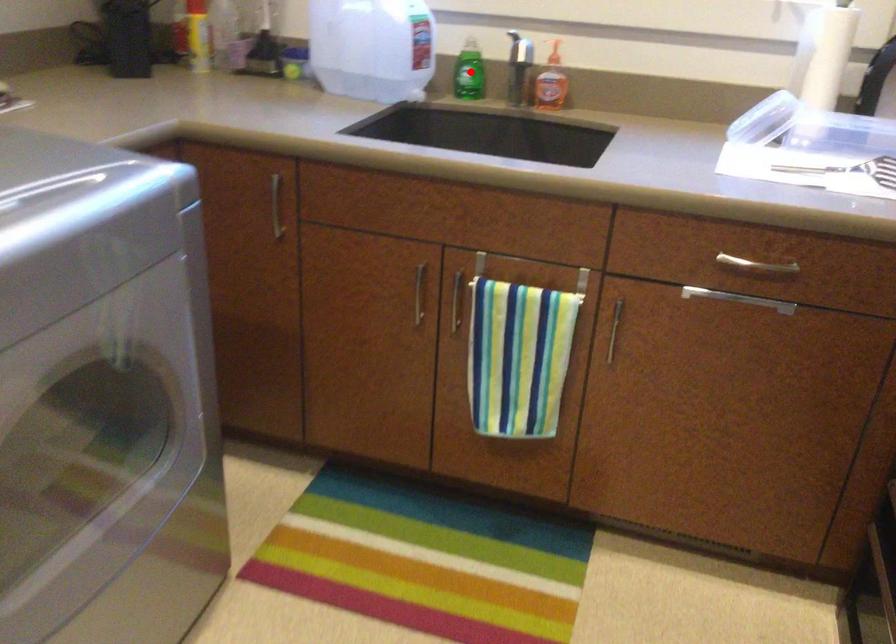
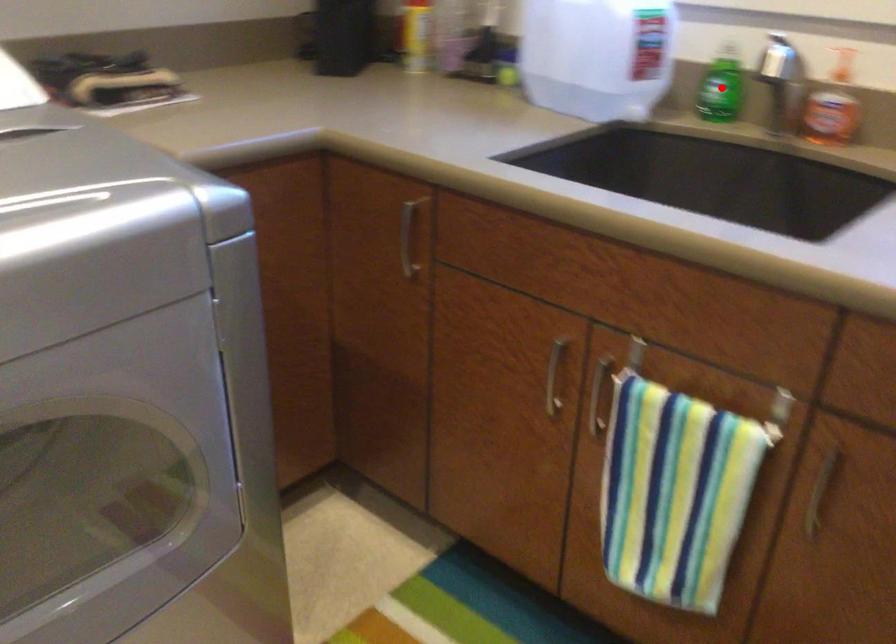
I am providing you with two images of the same scene from different viewpoints. A red point is marked on the first image and another point is marked on the second image. Do the highlighted points in image1 and image2 indicate the same real-world spot?

Yes